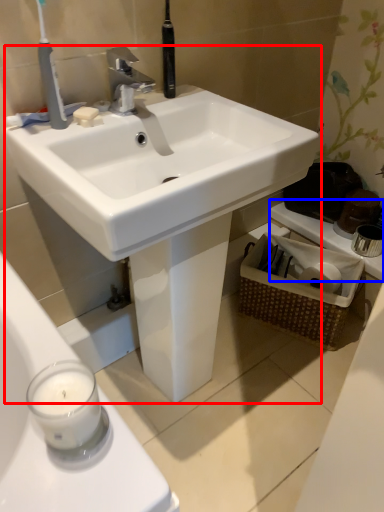
Question: Among these objects, which one is nearest to the camera, sink (highlighted by a red box) or counter top (highlighted by a blue box)?

Choices:
 (A) sink
 (B) counter top

Answer: (A)